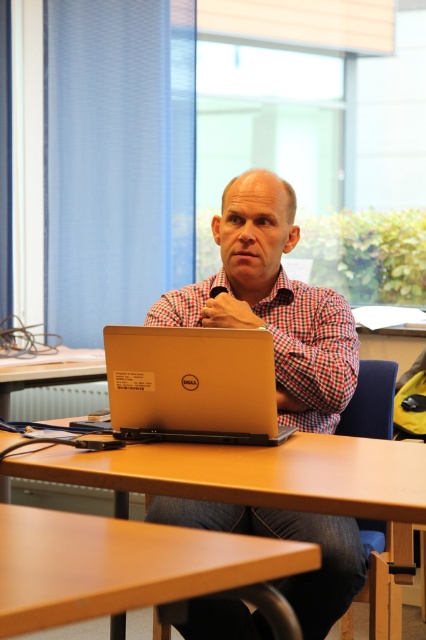
Question: Based on their relative distances, which object is farther from the checkered fabric shirt at center?

Choices:
 (A) brown wooden table at center
 (B) silver metallic laptop at center

Answer: (A)

Question: Is brown wooden table at center smaller than checkered fabric shirt at center?

Choices:
 (A) yes
 (B) no

Answer: (A)

Question: Which object appears closest to the camera in this image?

Choices:
 (A) checkered fabric shirt at center
 (B) brown wooden table at lower center

Answer: (B)

Question: Which of the following is the farthest from the observer?

Choices:
 (A) blue fabric chair at lower right
 (B) checkered fabric shirt at center
 (C) matte silver laptop at center

Answer: (A)

Question: Considering the relative positions of matte silver laptop at center and checkered fabric shirt at center in the image provided, where is matte silver laptop at center located with respect to checkered fabric shirt at center?

Choices:
 (A) left
 (B) right

Answer: (A)

Question: Does matte silver laptop at center have a greater width compared to blue fabric chair at lower right?

Choices:
 (A) no
 (B) yes

Answer: (B)